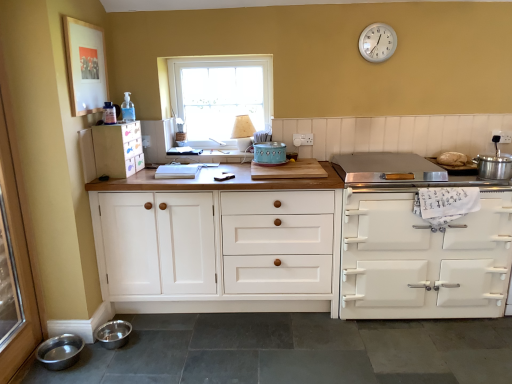
Find the location of a particular element. Image resolution: width=512 pixels, height=384 pixels. stainless steel pot at right, which is the 1th appliance from right to left is located at coordinates (494, 164).

Find the location of a particular element. This screenshot has height=384, width=512. transparent glass screen door at left is located at coordinates (15, 266).

This screenshot has height=384, width=512. I want to click on stainless steel bowl at lower left, positioned as the 2th bowl in right-to-left order, so click(60, 351).

At what (x,y) coordinates should I click in order to perform the action: click on stainless steel pot at right, which is the 1th appliance from right to left. Please return your answer as a coordinate pair (x, y). Image resolution: width=512 pixels, height=384 pixels. Looking at the image, I should click on (494, 164).

What's the angular difference between stainless steel pot at right, which is the 1th appliance from right to left, and silver metallic clock at upper right's facing directions?

The facing directions of stainless steel pot at right, which is the 1th appliance from right to left, and silver metallic clock at upper right are 0.00412 degrees apart.

Measure the distance from stainless steel pot at right, which is the 1th appliance from right to left, to silver metallic clock at upper right.

A distance of 38.79 inches exists between stainless steel pot at right, which is the 1th appliance from right to left, and silver metallic clock at upper right.

From the picture: Between stainless steel pot at right, which is the third appliance from left to right, and silver metallic clock at upper right, which one appears on the left side from the viewer's perspective?

From the viewer's perspective, silver metallic clock at upper right appears more on the left side.

Considering the relative sizes of stainless steel pot at right, which is the 1th appliance from right to left, and silver metallic clock at upper right in the image provided, is stainless steel pot at right, which is the 1th appliance from right to left, wider than silver metallic clock at upper right?

Indeed, stainless steel pot at right, which is the 1th appliance from right to left, has a greater width compared to silver metallic clock at upper right.

From the image's perspective, is white painted wood cabinet at left, the first cabinetry when ordered from left to right, above or below stainless steel pot at right, which is the third appliance from left to right?

Clearly, from the image's perspective, white painted wood cabinet at left, the first cabinetry when ordered from left to right, is above stainless steel pot at right, which is the third appliance from left to right.

Who is shorter, white painted wood cabinet at left, the first cabinetry when ordered from left to right, or stainless steel pot at right, which is the third appliance from left to right?

Standing shorter between the two is stainless steel pot at right, which is the third appliance from left to right.

Is white painted wood cabinet at left, the first cabinetry when ordered from left to right, positioned far away from stainless steel pot at right, which is the third appliance from left to right?

Yes, white painted wood cabinet at left, the first cabinetry when ordered from left to right, is far from stainless steel pot at right, which is the third appliance from left to right.

Where is `the 2nd cabinetry to the left of the stainless steel cooker at right, which is the 2th appliance from right to left, counting from the anchor's position`? The width and height of the screenshot is (512, 384). the 2nd cabinetry to the left of the stainless steel cooker at right, which is the 2th appliance from right to left, counting from the anchor's position is located at coordinates (118, 149).

Is stainless steel cooker at right, positioned as the second appliance in left-to-right order, smaller than white painted wood cabinet at left, which is the third cabinetry in right-to-left order?

No.

Which is in front, stainless steel cooker at right, which is the 2th appliance from right to left, or white painted wood cabinet at left, which is the third cabinetry in right-to-left order?

stainless steel cooker at right, which is the 2th appliance from right to left.

Is point (366, 173) positioned in front of point (106, 130)?

That is False.

From a real-world perspective, is stainless steel bowl at lower left, positioned as the 2th bowl in right-to-left order, positioned under white glossy stove at right, the first cabinetry in the right-to-left sequence, based on gravity?

Yes, from a real-world perspective, stainless steel bowl at lower left, positioned as the 2th bowl in right-to-left order, is beneath white glossy stove at right, the first cabinetry in the right-to-left sequence.

Considering the positions of objects stainless steel bowl at lower left, placed as the 1th bowl when sorted from left to right, and white glossy stove at right, the first cabinetry in the right-to-left sequence, in the image provided, who is more to the right, stainless steel bowl at lower left, placed as the 1th bowl when sorted from left to right, or white glossy stove at right, the first cabinetry in the right-to-left sequence,?

white glossy stove at right, the first cabinetry in the right-to-left sequence, is more to the right.

From the picture: Is stainless steel bowl at lower left, placed as the 1th bowl when sorted from left to right, oriented towards white glossy stove at right, which ranks as the 3th cabinetry in left-to-right order?

Yes, stainless steel bowl at lower left, placed as the 1th bowl when sorted from left to right, is turned towards white glossy stove at right, which ranks as the 3th cabinetry in left-to-right order.

Can you confirm if stainless steel bowl at lower left, positioned as the 2th bowl in right-to-left order, is shorter than white glossy stove at right, which ranks as the 3th cabinetry in left-to-right order?

Yes.

Is stainless steel pot at right, which is the 1th appliance from right to left, facing away from white wood cabinet at center, which is the 2th cabinetry in right-to-left order?

No.

Considering the relative positions of stainless steel pot at right, which is the third appliance from left to right, and white wood cabinet at center, which is the 2th cabinetry in right-to-left order, in the image provided, is stainless steel pot at right, which is the third appliance from left to right, to the right of white wood cabinet at center, which is the 2th cabinetry in right-to-left order, from the viewer's perspective?

Correct, you'll find stainless steel pot at right, which is the third appliance from left to right, to the right of white wood cabinet at center, which is the 2th cabinetry in right-to-left order.

From a real-world perspective, is stainless steel pot at right, which is the third appliance from left to right, on white wood cabinet at center, the 2th cabinetry in the left-to-right sequence?

Yes.

Is teal ceramic pot at center, acting as the third appliance starting from the right, surrounded by stainless steel cooker at right, which is the 2th appliance from right to left?

Actually, teal ceramic pot at center, acting as the third appliance starting from the right, is outside stainless steel cooker at right, which is the 2th appliance from right to left.

Is point (360, 158) positioned before point (265, 159)?

No, (360, 158) is behind (265, 159).

How different are the orientations of stainless steel cooker at right, which is the 2th appliance from right to left, and teal ceramic pot at center, acting as the third appliance starting from the right, in degrees?

0.000744 degrees separate the facing orientations of stainless steel cooker at right, which is the 2th appliance from right to left, and teal ceramic pot at center, acting as the third appliance starting from the right.

Is stainless steel cooker at right, which is the 2th appliance from right to left, bigger or smaller than teal ceramic pot at center, positioned as the first appliance in left-to-right order?

In the image, stainless steel cooker at right, which is the 2th appliance from right to left, appears to be larger than teal ceramic pot at center, positioned as the first appliance in left-to-right order.

Find the location of a particular element. Image resolution: width=512 pixels, height=384 pixels. the 3rd appliance directly beneath the white painted wood cabinet at left, which is the third cabinetry in right-to-left order (from a real-world perspective) is located at coordinates (386, 168).

How many degrees apart are the facing directions of white painted wood cabinet at left, the first cabinetry when ordered from left to right, and stainless steel cooker at right, positioned as the second appliance in left-to-right order?

They differ by 85.8 degrees in their facing directions.

From a real-world perspective, does white painted wood cabinet at left, the first cabinetry when ordered from left to right, sit lower than stainless steel cooker at right, positioned as the second appliance in left-to-right order?

Incorrect, from a real-world perspective, white painted wood cabinet at left, the first cabinetry when ordered from left to right, is higher than stainless steel cooker at right, positioned as the second appliance in left-to-right order.

At what (x,y) coordinates should I click in order to perform the action: click on appliance that is the 3rd one when counting forward from the silver metallic clock at upper right. Please return your answer as a coordinate pair (x, y). This screenshot has height=384, width=512. Looking at the image, I should click on (494, 164).

Which appliance is the 3rd one when counting from the right side of the white painted wood cabinet at left, which is the third cabinetry in right-to-left order? Please provide its 2D coordinates.

[(494, 164)]

Which object lies further to the anchor point stainless steel pot at right, which is the 1th appliance from right to left, white painted wood cabinet at left, which is the third cabinetry in right-to-left order, or teal ceramic pot at center, acting as the third appliance starting from the right?

Based on the image, white painted wood cabinet at left, which is the third cabinetry in right-to-left order, appears to be further to stainless steel pot at right, which is the 1th appliance from right to left.

Looking at this image, considering their positions, is white glossy stove at right, the first cabinetry in the right-to-left sequence, positioned further to stainless steel pot at right, which is the third appliance from left to right, than stainless steel cooker at right, which is the 2th appliance from right to left?

Based on the image, white glossy stove at right, the first cabinetry in the right-to-left sequence, appears to be further to stainless steel pot at right, which is the third appliance from left to right.

Which object lies further to the anchor point white glossy stove at right, the first cabinetry in the right-to-left sequence, stainless steel pot at right, which is the 1th appliance from right to left, or transparent glass screen door at left?

transparent glass screen door at left lies further to white glossy stove at right, the first cabinetry in the right-to-left sequence, than the other object.

Estimate the real-world distances between objects in this image. Which object is further from clear glass window at center, silver metallic clock at upper right or white glossy stove at right, which ranks as the 3th cabinetry in left-to-right order?

white glossy stove at right, which ranks as the 3th cabinetry in left-to-right order, is further to clear glass window at center.

Estimate the real-world distances between objects in this image. Which object is closer to white wood cabinet at center, the 2th cabinetry in the left-to-right sequence, silver metallic clock at upper right or silver metallic bowl at lower left, the 1th bowl positioned from the right?

Based on the image, silver metallic bowl at lower left, the 1th bowl positioned from the right, appears to be nearer to white wood cabinet at center, the 2th cabinetry in the left-to-right sequence.

From the image, which object appears to be nearer to transparent glass screen door at left, white painted wood cabinet at left, the first cabinetry when ordered from left to right, or stainless steel pot at right, which is the 1th appliance from right to left?

white painted wood cabinet at left, the first cabinetry when ordered from left to right, lies closer to transparent glass screen door at left than the other object.

Looking at the image, which one is located closer to teal ceramic pot at center, positioned as the first appliance in left-to-right order, white wood cabinet at center, which is the 2th cabinetry in right-to-left order, or stainless steel cooker at right, which is the 2th appliance from right to left?

Among the two, stainless steel cooker at right, which is the 2th appliance from right to left, is located nearer to teal ceramic pot at center, positioned as the first appliance in left-to-right order.

Estimate the real-world distances between objects in this image. Which object is further from teal ceramic pot at center, acting as the third appliance starting from the right, stainless steel cooker at right, which is the 2th appliance from right to left, or stainless steel pot at right, which is the third appliance from left to right?

The object further to teal ceramic pot at center, acting as the third appliance starting from the right, is stainless steel pot at right, which is the third appliance from left to right.

Identify the location of screen door between white painted wood cabinet at left, the first cabinetry when ordered from left to right, and silver metallic bowl at lower left, the 1th bowl positioned from the right, from top to bottom. (15, 266).

Identify the location of window between white painted wood cabinet at left, the first cabinetry when ordered from left to right, and silver metallic clock at upper right from left to right. This screenshot has height=384, width=512. (220, 97).

Identify the location of bowl between teal ceramic pot at center, acting as the third appliance starting from the right, and stainless steel bowl at lower left, positioned as the 2th bowl in right-to-left order, in the up-down direction. (113, 334).

The width and height of the screenshot is (512, 384). Find the location of `clock situated between white wood cabinet at center, which is the 2th cabinetry in right-to-left order, and stainless steel pot at right, which is the third appliance from left to right, from left to right`. clock situated between white wood cabinet at center, which is the 2th cabinetry in right-to-left order, and stainless steel pot at right, which is the third appliance from left to right, from left to right is located at coordinates (377, 42).